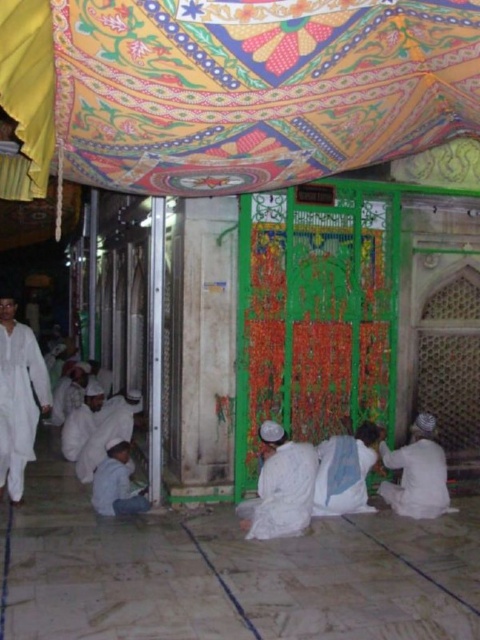
You are standing in front of the mosque entrance and need to locate both the textured fabric canopy at upper center and the white matte robe at lower right. From your perspective, which object is positioned to the left?

The textured fabric canopy at upper center is positioned to the left of the white matte robe at lower right.

You are standing in front of the mosque entrance and see the textured fabric canopy at upper center and the white matte robe at lower right. Which object is shorter in height?

The textured fabric canopy at upper center is not as tall as the white matte robe at lower right, so the textured fabric canopy at upper center is shorter in height.